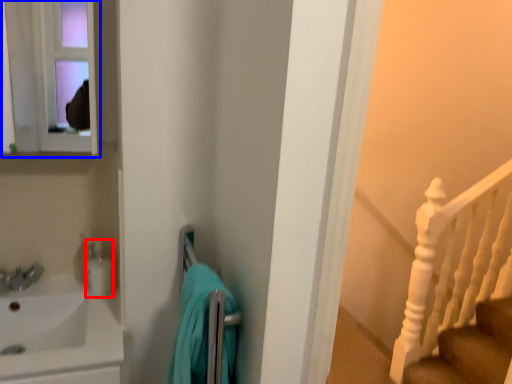
Question: Among these objects, which one is nearest to the camera, toiletry (highlighted by a red box) or medicine cabinet (highlighted by a blue box)?

Choices:
 (A) toiletry
 (B) medicine cabinet

Answer: (B)